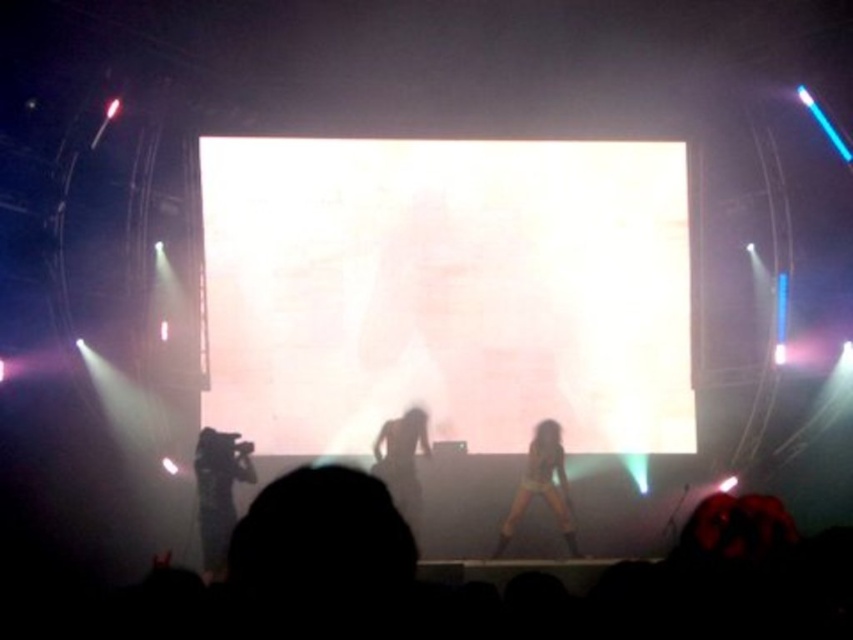
You are a photographer at the concert. You notice the dark fabric camera at lower left and the smooth skin at center. Which object is positioned lower in the image?

The dark fabric camera at lower left is located below smooth skin at center, so the dark fabric camera at lower left is positioned lower in the image.